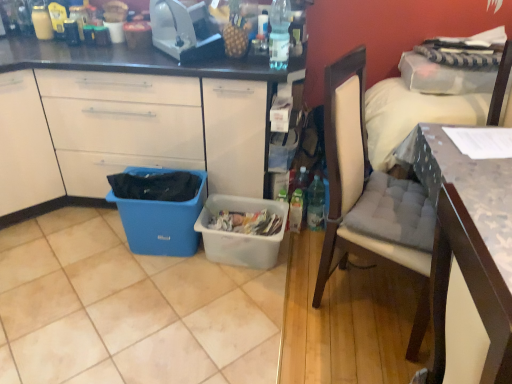
This screenshot has height=384, width=512. Identify the location of free space between light beige fabric chair at right and translucent plastic picnic basket at center. (278, 276).